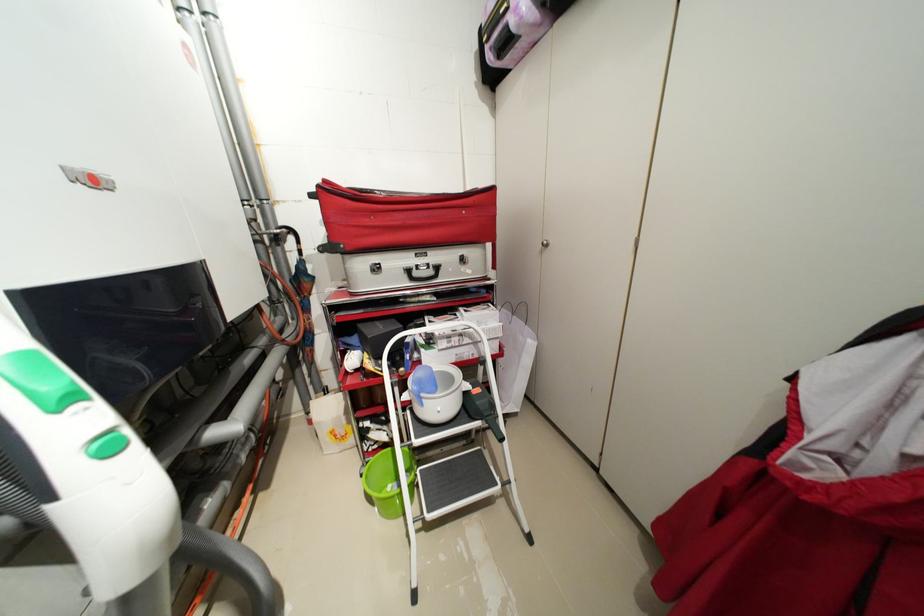
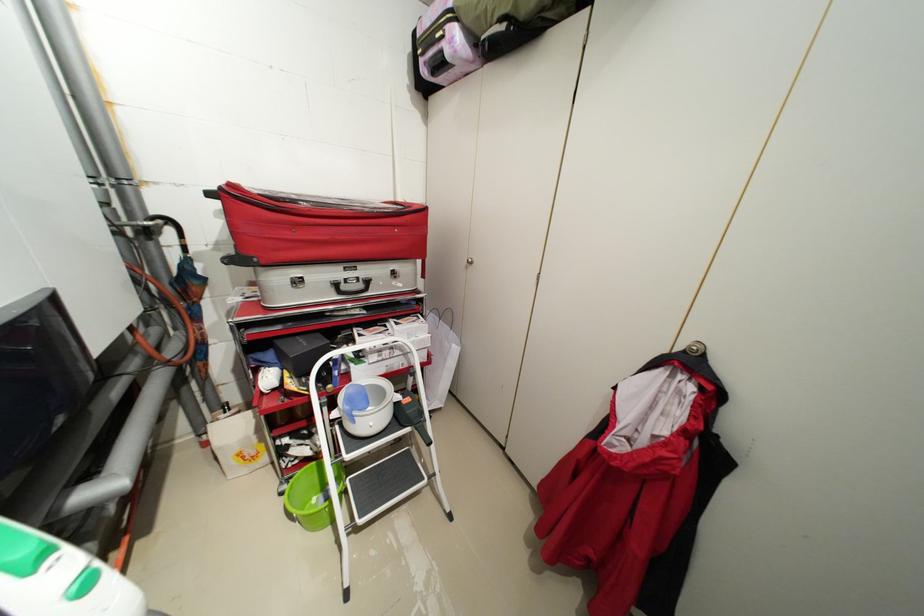
In a continuous first-person perspective shot, in which direction is the camera moving?

The cameraman walked toward left, backward.